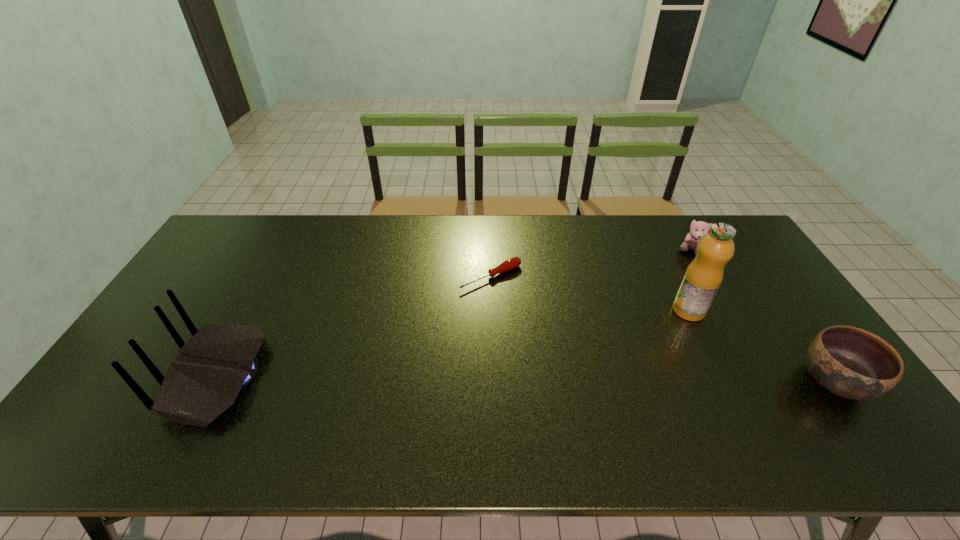
Locate an element on the screen. free region located at the face of the farthest object is located at coordinates (638, 301).

The width and height of the screenshot is (960, 540). Find the location of `object located at the far edge`. object located at the far edge is located at coordinates (698, 229).

Locate an element on the screen. The image size is (960, 540). router that is at the near edge is located at coordinates (219, 361).

Identify the location of bowl positioned at the near edge. Image resolution: width=960 pixels, height=540 pixels. (848, 362).

In order to click on object at the right edge in this screenshot , I will do `click(848, 362)`.

Identify the location of object at the near right corner. (848, 362).

At what (x,y) coordinates should I click in order to perform the action: click on free region at the far edge of the desktop. Please return your answer as a coordinate pair (x, y). Image resolution: width=960 pixels, height=540 pixels. Looking at the image, I should click on (436, 252).

This screenshot has width=960, height=540. Identify the location of vacant space at the near edge of the desktop. (372, 386).

The width and height of the screenshot is (960, 540). I want to click on vacant area at the left edge of the desktop, so click(176, 314).

In the image, there is a desktop. In order to click on vacant region at the right edge in this screenshot , I will do tap(759, 265).